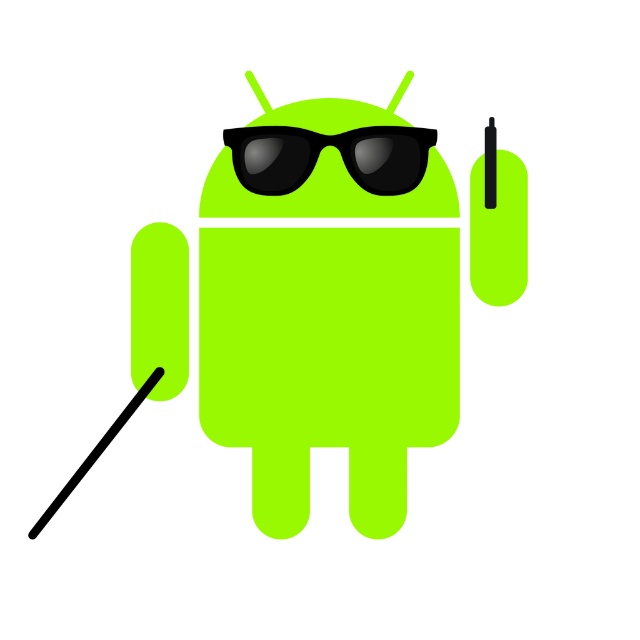
Locate an element on the screen. The height and width of the screenshot is (640, 640). lime matte android at center is located at coordinates (328, 356).

Identify the location of lime matte android at center. (328, 356).